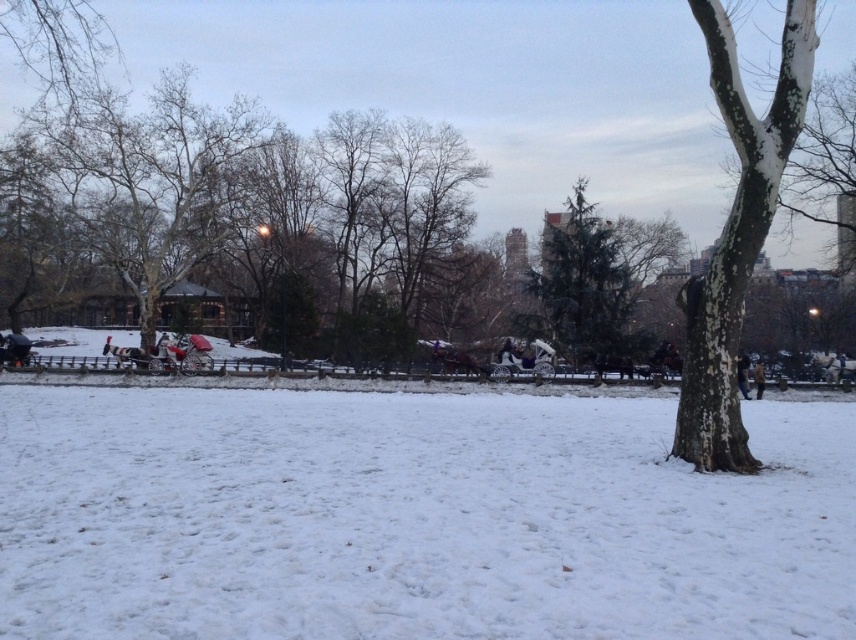
You are a photographer standing in the winter park scene. You want to capture a photo that includes both the white fluffy snow at center and the white textured bark at center. Based on their positions, which object should you adjust your camera angle to focus on first to ensure both are in the frame?

Since the white fluffy snow at center is to the left of the white textured bark at center, you should first focus on the white textured bark at center to ensure the leftward white fluffy snow at center is also captured in the frame.

Looking at this image, you are standing at the point marked as point (584, 284) in the image. What object is exactly at this point?

The green textured tree at center is exactly at point 0.443, 0.683.

You are a photographer standing in the snow. You want to take a picture of the smooth bark tree at left and the brown leather jacket at lower right. Which object will appear larger in your photo?

The smooth bark tree at left is taller than the brown leather jacket at lower right, so it will appear larger in the photo.